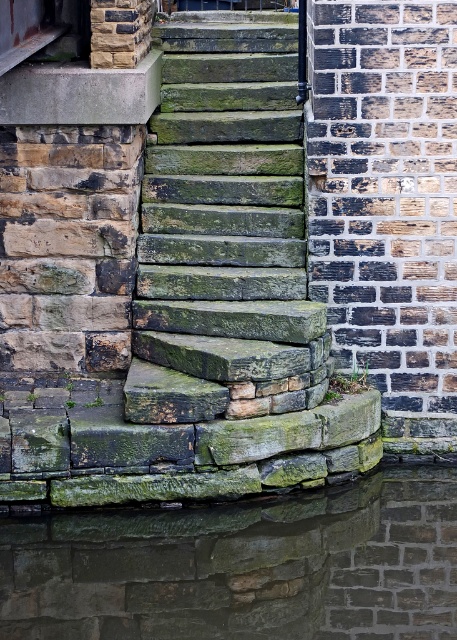
Question: Can you confirm if green mossy stone stairs at center is smaller than green mossy stone at lower center?

Choices:
 (A) yes
 (B) no

Answer: (B)

Question: Which point is farther to the camera?

Choices:
 (A) (164, 60)
 (B) (106, 632)

Answer: (A)

Question: Which point appears farthest from the camera in this image?

Choices:
 (A) (175, 632)
 (B) (155, 326)

Answer: (B)

Question: Does green mossy stone stairs at center have a greater width compared to green mossy stone at lower center?

Choices:
 (A) no
 (B) yes

Answer: (A)

Question: Is green mossy stone stairs at center positioned before green mossy stone at lower center?

Choices:
 (A) no
 (B) yes

Answer: (A)